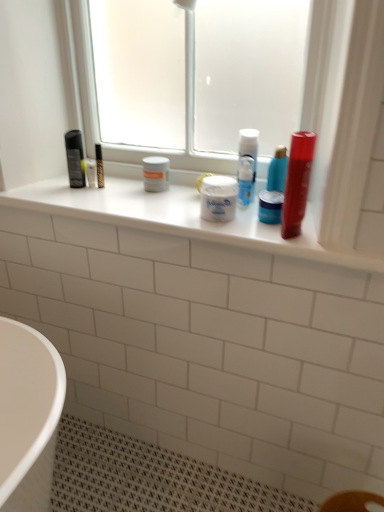
Question: Is shiny red tube at upper right, arranged as the second mouthwash when viewed from the back, not close to transparent frosted glass at upper center?

Choices:
 (A) yes
 (B) no

Answer: (B)

Question: Is shiny red tube at upper right, which is the first mouthwash in front-to-back order, not within transparent frosted glass at upper center?

Choices:
 (A) no
 (B) yes

Answer: (B)

Question: Considering the relative sizes of shiny red tube at upper right, which is the first mouthwash in front-to-back order, and transparent frosted glass at upper center in the image provided, is shiny red tube at upper right, which is the first mouthwash in front-to-back order, thinner than transparent frosted glass at upper center?

Choices:
 (A) yes
 (B) no

Answer: (A)

Question: Considering the relative sizes of shiny red tube at upper right, which is the first mouthwash in front-to-back order, and transparent frosted glass at upper center in the image provided, is shiny red tube at upper right, which is the first mouthwash in front-to-back order, bigger than transparent frosted glass at upper center?

Choices:
 (A) yes
 (B) no

Answer: (B)

Question: Is transparent frosted glass at upper center a part of shiny red tube at upper right, arranged as the second mouthwash when viewed from the back?

Choices:
 (A) no
 (B) yes

Answer: (A)

Question: Is shiny red tube at upper right, which is the first mouthwash in front-to-back order, beside transparent frosted glass at upper center?

Choices:
 (A) no
 (B) yes

Answer: (A)

Question: From the image's perspective, is white plastic container at center on shiny red tube at upper right, which is the first mouthwash in front-to-back order?

Choices:
 (A) yes
 (B) no

Answer: (A)

Question: Is white plastic container at center positioned far away from shiny red tube at upper right, which is the first mouthwash in front-to-back order?

Choices:
 (A) no
 (B) yes

Answer: (A)

Question: Is the position of white plastic container at center less distant than that of shiny red tube at upper right, arranged as the second mouthwash when viewed from the back?

Choices:
 (A) no
 (B) yes

Answer: (A)

Question: Does white plastic container at center contain shiny red tube at upper right, arranged as the second mouthwash when viewed from the back?

Choices:
 (A) yes
 (B) no

Answer: (B)

Question: Can you confirm if white plastic container at center is thinner than shiny red tube at upper right, which is the first mouthwash in front-to-back order?

Choices:
 (A) no
 (B) yes

Answer: (A)

Question: Can you confirm if white plastic container at center is wider than shiny red tube at upper right, which is the first mouthwash in front-to-back order?

Choices:
 (A) yes
 (B) no

Answer: (A)

Question: Is blue glossy jar at center, which ranks as the second mouthwash in front-to-back order, outside of white plastic container at center?

Choices:
 (A) no
 (B) yes

Answer: (B)